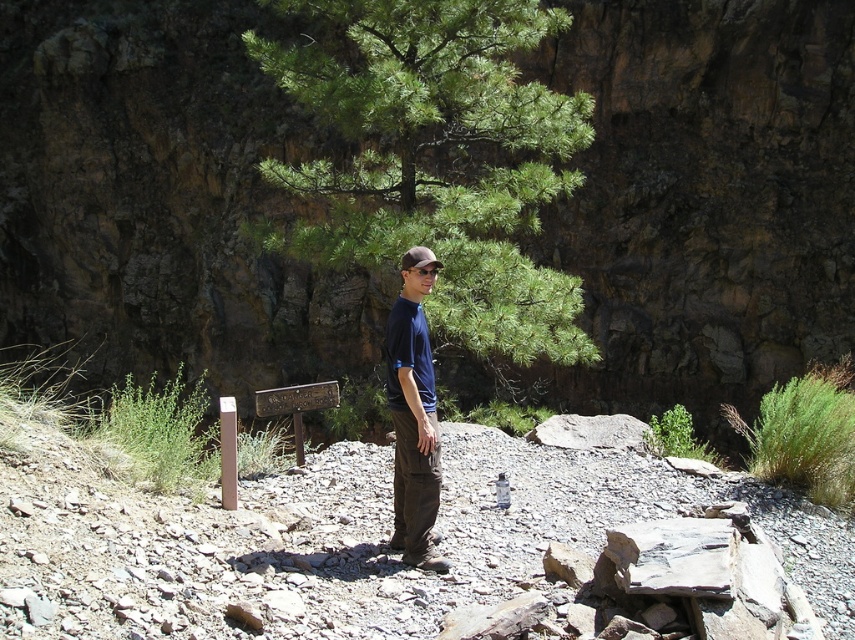
Question: Which of the following is the closest to the observer?

Choices:
 (A) (446, 228)
 (B) (401, 352)

Answer: (B)

Question: From the image, what is the correct spatial relationship of green leafy tree at center in relation to dark blue t-shirt at center?

Choices:
 (A) right
 (B) left

Answer: (B)

Question: In this image, where is green leafy tree at center located relative to dark blue t-shirt at center?

Choices:
 (A) right
 (B) left

Answer: (B)

Question: Does green leafy tree at center appear on the right side of dark blue t-shirt at center?

Choices:
 (A) yes
 (B) no

Answer: (B)